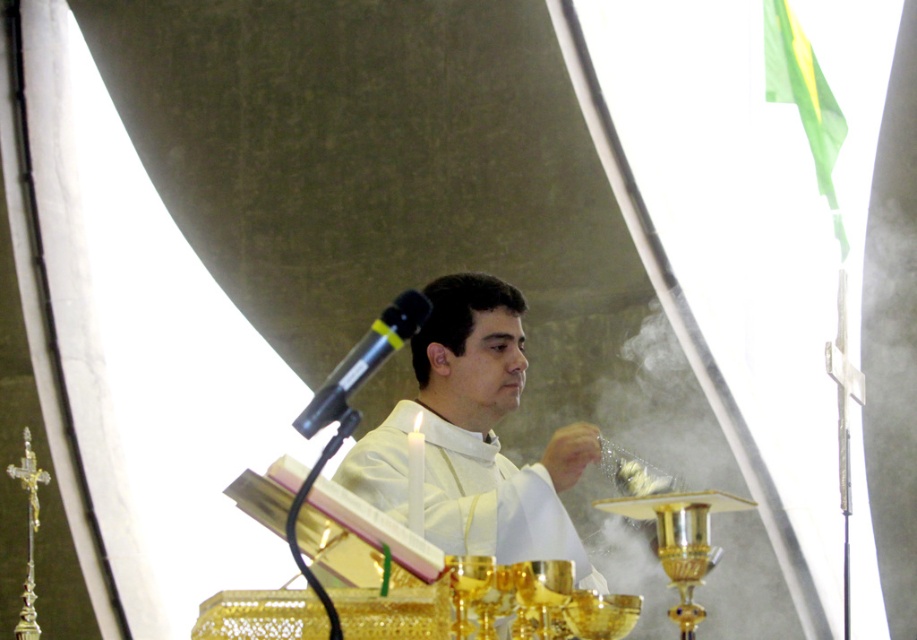
Question: Which point is closer to the camera taking this photo?

Choices:
 (A) (x=391, y=324)
 (B) (x=547, y=557)

Answer: (A)

Question: Does white matte/soft cloth at center have a smaller size compared to black plastic microphone at upper center?

Choices:
 (A) yes
 (B) no

Answer: (A)

Question: Which point is closer to the camera taking this photo?

Choices:
 (A) (551, 525)
 (B) (304, 428)

Answer: (B)

Question: Can you confirm if white matte/soft cloth at center is positioned to the left of black plastic microphone at upper center?

Choices:
 (A) yes
 (B) no

Answer: (B)

Question: Observing the image, what is the correct spatial positioning of white matte/soft cloth at center in reference to black plastic microphone at upper center?

Choices:
 (A) right
 (B) left

Answer: (A)

Question: Which point is closer to the camera?

Choices:
 (A) white matte/soft cloth at center
 (B) black plastic microphone at upper center

Answer: (B)